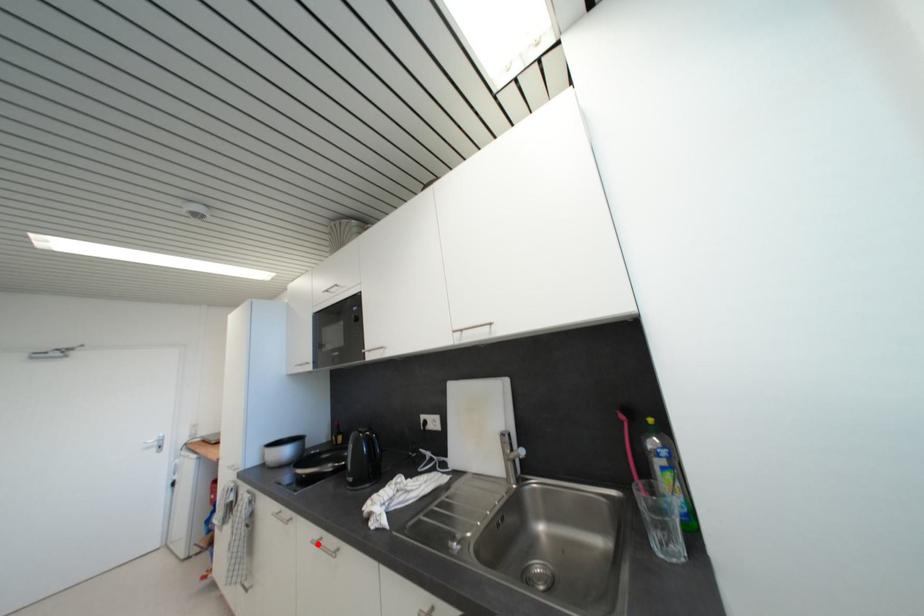
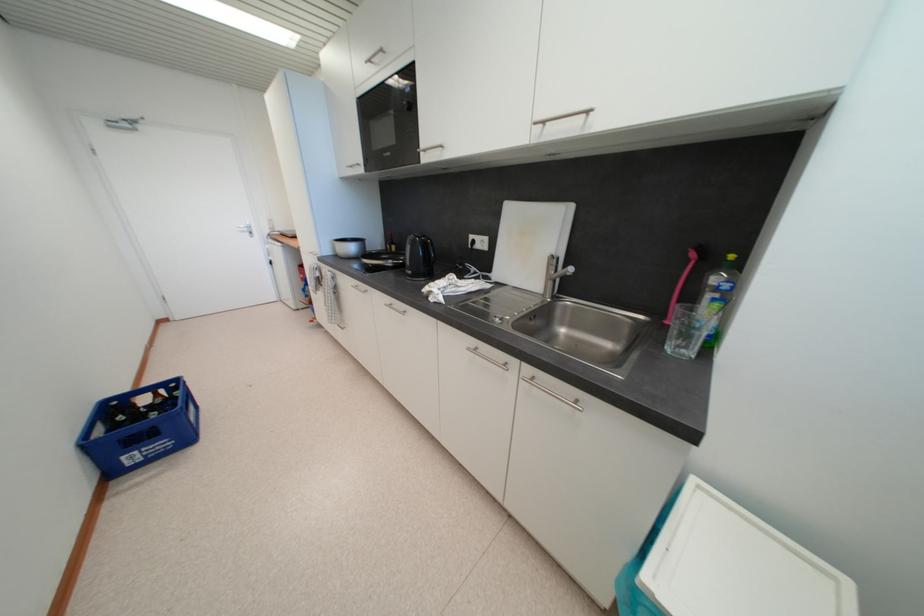
Question: I am providing you with two images of the same scene from different viewpoints. A red point is marked on the first image. Can you still see the location of the red point in image 2?

Choices:
 (A) Yes
 (B) No

Answer: (A)